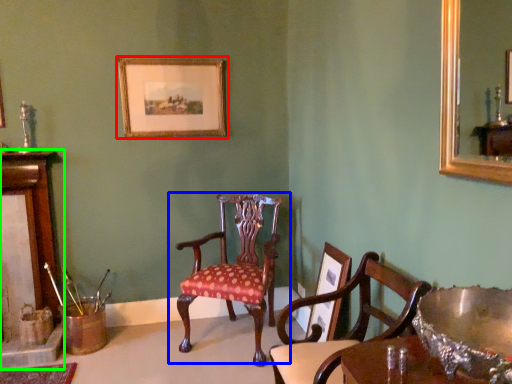
Question: Considering the real-world distances, which object is farthest from picture frame (highlighted by a red box)? chair (highlighted by a blue box) or fireplace (highlighted by a green box)?

Choices:
 (A) chair
 (B) fireplace

Answer: (B)